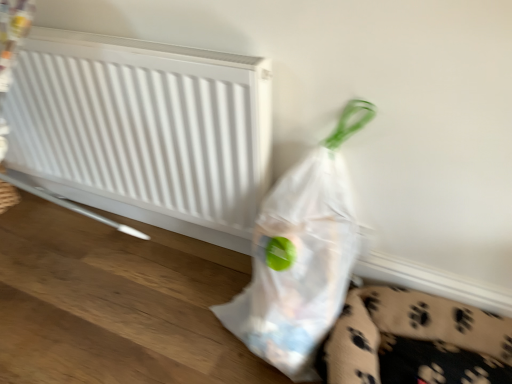
What do you see at coordinates (144, 129) in the screenshot?
I see `white matte radiator at upper left` at bounding box center [144, 129].

Find the location of `white matte radiator at upper left`. white matte radiator at upper left is located at coordinates (144, 129).

What do you see at coordinates (301, 257) in the screenshot? I see `transparent plastic bag at lower right` at bounding box center [301, 257].

What is the approximate height of transparent plastic bag at lower right?

transparent plastic bag at lower right is 64.06 centimeters tall.

Image resolution: width=512 pixels, height=384 pixels. I want to click on transparent plastic bag at lower right, so click(x=301, y=257).

This screenshot has width=512, height=384. Identify the location of white matte radiator at upper left. (144, 129).

Is transparent plastic bag at lower right to the left or to the right of white matte radiator at upper left in the image?

transparent plastic bag at lower right is positioned on white matte radiator at upper left's right side.

Considering their positions, is transparent plastic bag at lower right located in front of or behind white matte radiator at upper left?

transparent plastic bag at lower right is positioned closer to the viewer than white matte radiator at upper left.

Between point (310, 322) and point (209, 56), which one is positioned in front?

The point (209, 56) is in front.

From the image's perspective, which one is positioned lower, transparent plastic bag at lower right or white matte radiator at upper left?

transparent plastic bag at lower right.

From a real-world perspective, between transparent plastic bag at lower right and white matte radiator at upper left, who is vertically higher?

white matte radiator at upper left is physically above.

Which of these two, transparent plastic bag at lower right or white matte radiator at upper left, is wider?

Wider between the two is transparent plastic bag at lower right.

Is transparent plastic bag at lower right shorter than white matte radiator at upper left?

No, transparent plastic bag at lower right is not shorter than white matte radiator at upper left.

Between transparent plastic bag at lower right and white matte radiator at upper left, which one has larger size?

transparent plastic bag at lower right.

Is transparent plastic bag at lower right not within white matte radiator at upper left?

Indeed, transparent plastic bag at lower right is completely outside white matte radiator at upper left.

Is there a large distance between transparent plastic bag at lower right and white matte radiator at upper left?

No, transparent plastic bag at lower right is not far from white matte radiator at upper left.

Consider the image. Is transparent plastic bag at lower right looking in the opposite direction of white matte radiator at upper left?

No.

What's the angular difference between transparent plastic bag at lower right and white matte radiator at upper left's facing directions?

There is a 1.31-degree angle between the facing directions of transparent plastic bag at lower right and white matte radiator at upper left.

I want to click on radiator lying behind the transparent plastic bag at lower right, so click(x=144, y=129).

Considering the positions of objects white matte radiator at upper left and transparent plastic bag at lower right in the image provided, who is more to the right, white matte radiator at upper left or transparent plastic bag at lower right?

From the viewer's perspective, transparent plastic bag at lower right appears more on the right side.

Which object is closer to the camera taking this photo, white matte radiator at upper left or transparent plastic bag at lower right?

transparent plastic bag at lower right is in front.

Which is closer to the camera, [180,49] or [362,121]?

Clearly, point [180,49] is more distant from the camera than point [362,121].

Based on the photo, from the image's perspective, would you say white matte radiator at upper left is positioned over transparent plastic bag at lower right?

Indeed, from the image's perspective, white matte radiator at upper left is shown above transparent plastic bag at lower right.

From a real-world perspective, is white matte radiator at upper left positioned under transparent plastic bag at lower right based on gravity?

No, from a real-world perspective, white matte radiator at upper left is not beneath transparent plastic bag at lower right.

Between white matte radiator at upper left and transparent plastic bag at lower right, which one has smaller width?

With smaller width is white matte radiator at upper left.

Between white matte radiator at upper left and transparent plastic bag at lower right, which one has less height?

Standing shorter between the two is white matte radiator at upper left.

Considering the sizes of objects white matte radiator at upper left and transparent plastic bag at lower right in the image provided, who is bigger, white matte radiator at upper left or transparent plastic bag at lower right?

With larger size is transparent plastic bag at lower right.

Can we say white matte radiator at upper left lies outside transparent plastic bag at lower right?

Absolutely, white matte radiator at upper left is external to transparent plastic bag at lower right.

Is white matte radiator at upper left placed right next to transparent plastic bag at lower right?

white matte radiator at upper left and transparent plastic bag at lower right are clearly separated.

Could you tell me if white matte radiator at upper left is facing transparent plastic bag at lower right?

No, white matte radiator at upper left is not facing towards transparent plastic bag at lower right.

How much distance is there between white matte radiator at upper left and transparent plastic bag at lower right?

white matte radiator at upper left is 16.63 inches from transparent plastic bag at lower right.

This screenshot has height=384, width=512. I want to click on radiator that appears above the transparent plastic bag at lower right (from the image's perspective), so click(144, 129).

At what (x,y) coordinates should I click in order to perform the action: click on plastic bag on the right of white matte radiator at upper left. Please return your answer as a coordinate pair (x, y). Looking at the image, I should click on (301, 257).

Where is `radiator on the left of the transparent plastic bag at lower right`? The width and height of the screenshot is (512, 384). radiator on the left of the transparent plastic bag at lower right is located at coordinates (144, 129).